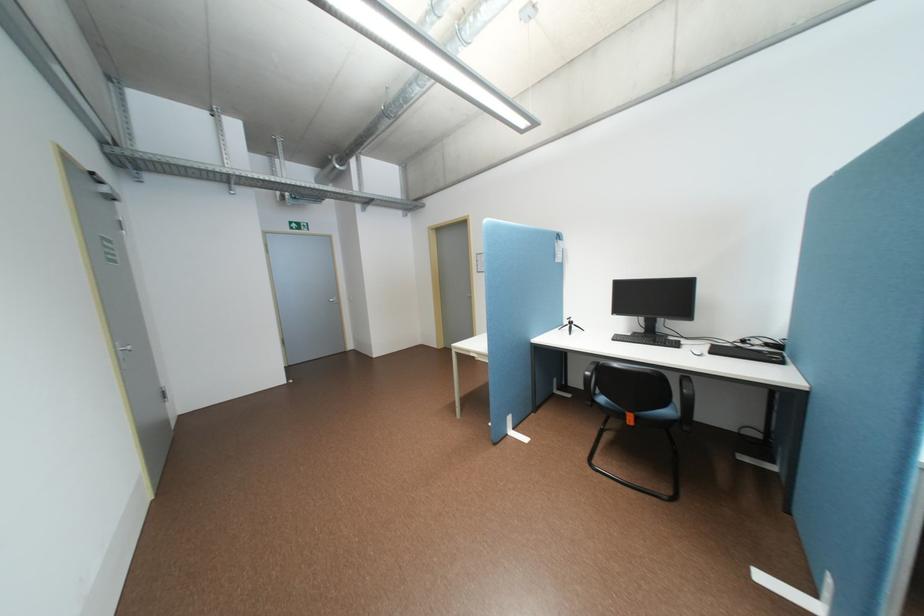
You are a GUI agent. You are given a task and a screenshot of the screen. Output one action in this format:
    pyautogui.click(x=<x>, y=<y>)
    Task: Click on the black power strip
    
    Given the screenshot: What is the action you would take?
    pyautogui.click(x=246, y=177)